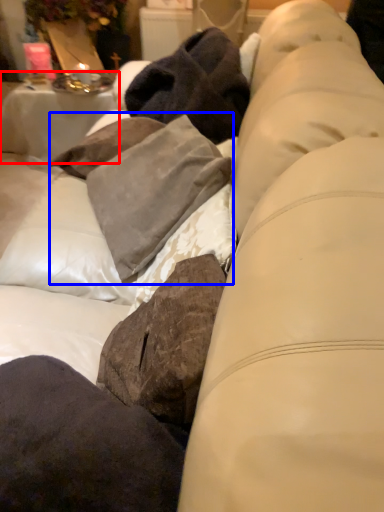
Question: Which object is further to the camera taking this photo, table (highlighted by a red box) or clothing (highlighted by a blue box)?

Choices:
 (A) table
 (B) clothing

Answer: (A)